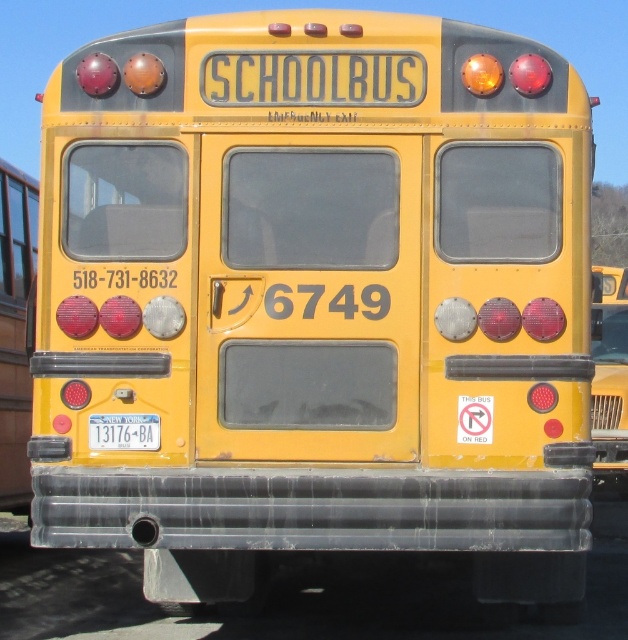
You are standing 20 feet away from the rear of the school bus. Can you see the point at coordinates point (122,568) from your current position?

The distance of point (122,568) from camera is 30.64 feet, so you are standing 20 feet away from the rear of the school bus, which is closer than the point. Therefore, you can see the point at coordinates point (122,568) from your current position.

Based on the photo, you are a delivery driver approaching a yellow school bus from behind. You need to locate the license plate to verify the vehicle registration. The bus has a transparent plastic pipe at lower center and a white plastic license plate at center. According to the scene description, where is the transparent plastic pipe located in relation to the license plate?

The transparent plastic pipe at lower center is located to the left of the white plastic license plate at center.